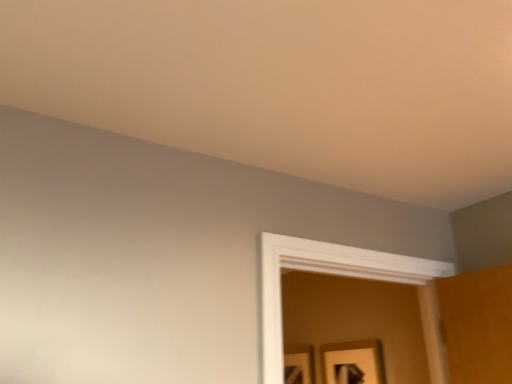
The image size is (512, 384). Identify the location of matte black picture frame at lower center, the second picture frame positioned from the right. (298, 366).

What do you see at coordinates (298, 366) in the screenshot? I see `matte black picture frame at lower center, the 1th picture frame in the left-to-right sequence` at bounding box center [298, 366].

The height and width of the screenshot is (384, 512). What are the coordinates of `wooden framed picture at lower right, the 1th picture frame in the right-to-left sequence` in the screenshot? It's located at (353, 362).

Describe the element at coordinates (353, 362) in the screenshot. The image size is (512, 384). I see `wooden framed picture at lower right, the 1th picture frame in the right-to-left sequence` at that location.

Image resolution: width=512 pixels, height=384 pixels. In order to click on matte black picture frame at lower center, the 1th picture frame in the left-to-right sequence in this screenshot , I will do `click(298, 366)`.

Which is more to the right, matte black picture frame at lower center, which is counted as the 1th picture frame, starting from the back, or wooden framed picture at lower right, the 1th picture frame in the right-to-left sequence?

Positioned to the right is wooden framed picture at lower right, the 1th picture frame in the right-to-left sequence.

Relative to wooden framed picture at lower right, the second picture frame positioned from the back, is matte black picture frame at lower center, the second picture frame positioned from the right, in front or behind?

In the image, matte black picture frame at lower center, the second picture frame positioned from the right, appears behind wooden framed picture at lower right, the second picture frame positioned from the back.

Looking at this image, which point is more forward, (304, 365) or (371, 341)?

Point (371, 341)

From the image's perspective, is matte black picture frame at lower center, the second picture frame positioned from the right, on top of wooden framed picture at lower right, which is the 2th picture frame in left-to-right order?

Incorrect, from the image's perspective, matte black picture frame at lower center, the second picture frame positioned from the right, is lower than wooden framed picture at lower right, which is the 2th picture frame in left-to-right order.

From a real-world perspective, who is located higher, matte black picture frame at lower center, which is counted as the 1th picture frame, starting from the back, or wooden framed picture at lower right, the 1th picture frame in the right-to-left sequence?

wooden framed picture at lower right, the 1th picture frame in the right-to-left sequence, is physically above.

Between matte black picture frame at lower center, the 2th picture frame when ordered from front to back, and wooden framed picture at lower right, the 1th picture frame viewed from the front, which one has larger width?

wooden framed picture at lower right, the 1th picture frame viewed from the front.

Who is taller, matte black picture frame at lower center, which is counted as the 1th picture frame, starting from the back, or wooden framed picture at lower right, the 1th picture frame viewed from the front?

Standing taller between the two is matte black picture frame at lower center, which is counted as the 1th picture frame, starting from the back.

Who is smaller, matte black picture frame at lower center, the 2th picture frame when ordered from front to back, or wooden framed picture at lower right, the 1th picture frame in the right-to-left sequence?

With smaller size is matte black picture frame at lower center, the 2th picture frame when ordered from front to back.

Do you think matte black picture frame at lower center, the second picture frame positioned from the right, is within wooden framed picture at lower right, which is the 2th picture frame in left-to-right order, or outside of it?

matte black picture frame at lower center, the second picture frame positioned from the right, lies outside wooden framed picture at lower right, which is the 2th picture frame in left-to-right order.

In the scene shown: Is matte black picture frame at lower center, the second picture frame positioned from the right, far from wooden framed picture at lower right, which is the 2th picture frame in left-to-right order?

They are positioned close to each other.

Is matte black picture frame at lower center, the second picture frame positioned from the right, positioned with its back to wooden framed picture at lower right, which is the 2th picture frame in left-to-right order?

That's not correct — matte black picture frame at lower center, the second picture frame positioned from the right, is not looking away from wooden framed picture at lower right, which is the 2th picture frame in left-to-right order.

What's the angular difference between matte black picture frame at lower center, the second picture frame positioned from the right, and wooden framed picture at lower right, the second picture frame positioned from the back,'s facing directions?

The angular difference between matte black picture frame at lower center, the second picture frame positioned from the right, and wooden framed picture at lower right, the second picture frame positioned from the back, is 0.835 degrees.

Find the location of a particular element. This screenshot has height=384, width=512. picture frame that is above the matte black picture frame at lower center, the second picture frame positioned from the right (from the image's perspective) is located at coordinates tap(353, 362).

Considering the relative positions of wooden framed picture at lower right, the 1th picture frame viewed from the front, and matte black picture frame at lower center, the second picture frame positioned from the right, in the image provided, is wooden framed picture at lower right, the 1th picture frame viewed from the front, to the right of matte black picture frame at lower center, the second picture frame positioned from the right, from the viewer's perspective?

Yes.

Relative to matte black picture frame at lower center, the second picture frame positioned from the right, is wooden framed picture at lower right, the 1th picture frame in the right-to-left sequence, in front or behind?

wooden framed picture at lower right, the 1th picture frame in the right-to-left sequence, is positioned closer to the viewer than matte black picture frame at lower center, the second picture frame positioned from the right.

Does point (351, 366) come behind point (287, 349)?

No, (351, 366) is closer to viewer.

From the image's perspective, which is below, wooden framed picture at lower right, the second picture frame positioned from the back, or matte black picture frame at lower center, the 1th picture frame in the left-to-right sequence?

matte black picture frame at lower center, the 1th picture frame in the left-to-right sequence, is shown below in the image.

From a real-world perspective, is wooden framed picture at lower right, the 1th picture frame viewed from the front, positioned over matte black picture frame at lower center, the second picture frame positioned from the right, based on gravity?

Yes, from a real-world perspective, wooden framed picture at lower right, the 1th picture frame viewed from the front, is on top of matte black picture frame at lower center, the second picture frame positioned from the right.

Which object is thinner, wooden framed picture at lower right, which is the 2th picture frame in left-to-right order, or matte black picture frame at lower center, the 1th picture frame in the left-to-right sequence?

matte black picture frame at lower center, the 1th picture frame in the left-to-right sequence.

Considering the sizes of objects wooden framed picture at lower right, which is the 2th picture frame in left-to-right order, and matte black picture frame at lower center, the 2th picture frame when ordered from front to back, in the image provided, who is shorter, wooden framed picture at lower right, which is the 2th picture frame in left-to-right order, or matte black picture frame at lower center, the 2th picture frame when ordered from front to back,?

With less height is wooden framed picture at lower right, which is the 2th picture frame in left-to-right order.

Who is bigger, wooden framed picture at lower right, which is the 2th picture frame in left-to-right order, or matte black picture frame at lower center, which is counted as the 1th picture frame, starting from the back?

With larger size is wooden framed picture at lower right, which is the 2th picture frame in left-to-right order.

Is wooden framed picture at lower right, which is the 2th picture frame in left-to-right order, not within matte black picture frame at lower center, the second picture frame positioned from the right?

Yes, wooden framed picture at lower right, which is the 2th picture frame in left-to-right order, is located beyond the bounds of matte black picture frame at lower center, the second picture frame positioned from the right.

Is wooden framed picture at lower right, the 1th picture frame viewed from the front, next to matte black picture frame at lower center, which is counted as the 1th picture frame, starting from the back?

No, wooden framed picture at lower right, the 1th picture frame viewed from the front, is not beside matte black picture frame at lower center, which is counted as the 1th picture frame, starting from the back.

Is wooden framed picture at lower right, the 1th picture frame viewed from the front, positioned with its back to matte black picture frame at lower center, the 2th picture frame when ordered from front to back?

No, wooden framed picture at lower right, the 1th picture frame viewed from the front, is not facing the opposite direction of matte black picture frame at lower center, the 2th picture frame when ordered from front to back.

Could you measure the distance between wooden framed picture at lower right, the second picture frame positioned from the back, and matte black picture frame at lower center, the 1th picture frame in the left-to-right sequence?

wooden framed picture at lower right, the second picture frame positioned from the back, is 14.52 inches away from matte black picture frame at lower center, the 1th picture frame in the left-to-right sequence.

In the image, there is a wooden framed picture at lower right, the 1th picture frame in the right-to-left sequence. Where is `picture frame below it (from a real-world perspective)`? Image resolution: width=512 pixels, height=384 pixels. picture frame below it (from a real-world perspective) is located at coordinates (298, 366).

Where is `picture frame behind the wooden framed picture at lower right, the 1th picture frame viewed from the front`? Image resolution: width=512 pixels, height=384 pixels. picture frame behind the wooden framed picture at lower right, the 1th picture frame viewed from the front is located at coordinates (298, 366).

The width and height of the screenshot is (512, 384). What are the coordinates of `picture frame lying below the wooden framed picture at lower right, the 1th picture frame in the right-to-left sequence (from the image's perspective)` in the screenshot? It's located at (298, 366).